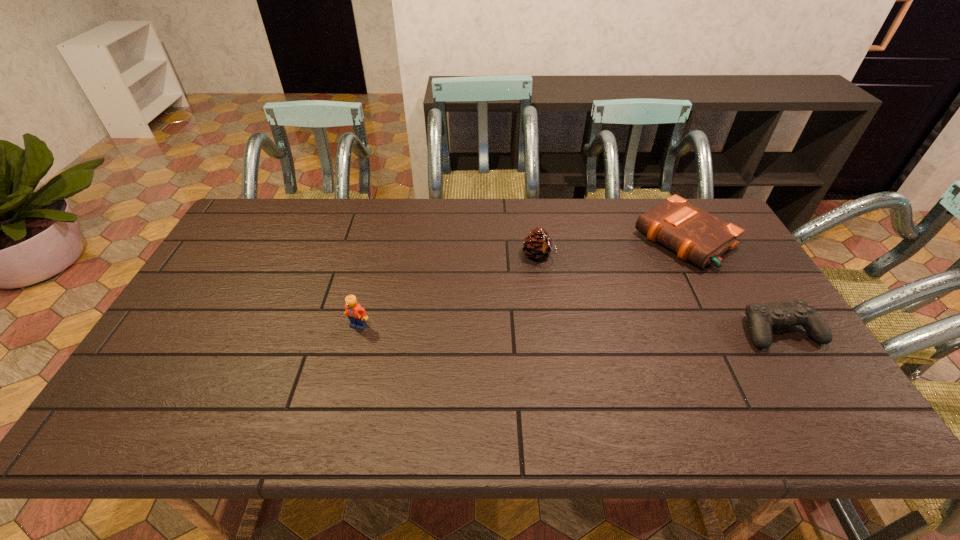
What are the coordinates of `the leftmost object` in the screenshot? It's located at (357, 315).

Locate an element on the screen. This screenshot has width=960, height=540. control is located at coordinates (761, 317).

The image size is (960, 540). I want to click on Bible, so click(695, 235).

You are a GUI agent. You are given a task and a screenshot of the screen. Output one action in this format:
    pyautogui.click(x=<x>, y=<y>)
    Task: Click on the pinecone
    
    Given the screenshot: What is the action you would take?
    pyautogui.click(x=537, y=245)

Image resolution: width=960 pixels, height=540 pixels. Find the location of `free location located on the front-facing side of the leftmost object`. free location located on the front-facing side of the leftmost object is located at coordinates (353, 346).

Identify the location of vacant space situated 0.120m on the back of the control. (749, 280).

This screenshot has width=960, height=540. In order to click on free location located on the spine side of the Bible in this screenshot , I will do `click(588, 302)`.

I want to click on vacant region located 0.230m on the spine side of the Bible, so click(604, 291).

Where is `vacant space located 0.280m on the spine side of the Bible`? vacant space located 0.280m on the spine side of the Bible is located at coordinates (592, 299).

You are a GUI agent. You are given a task and a screenshot of the screen. Output one action in this format:
    pyautogui.click(x=<x>, y=<y>)
    Task: Click on the vacant area situated with a leaf charm attached to the third object from right to left
    This screenshot has height=540, width=960.
    Given the screenshot: What is the action you would take?
    pyautogui.click(x=595, y=321)